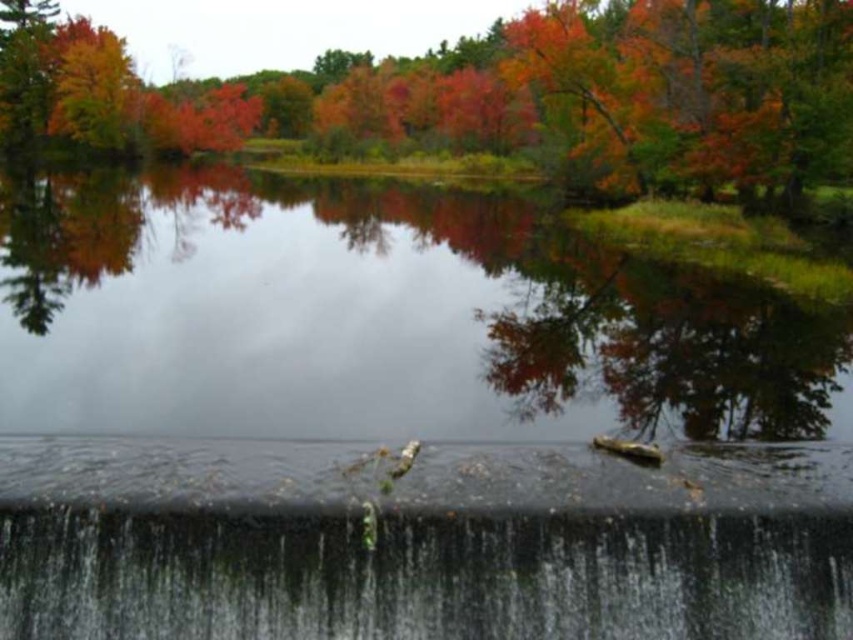
Question: Does autumn leaves at upper center have a greater width compared to green mossy concrete waterfall at lower center?

Choices:
 (A) no
 (B) yes

Answer: (B)

Question: Is autumn leaves at upper center thinner than green mossy concrete waterfall at lower center?

Choices:
 (A) no
 (B) yes

Answer: (A)

Question: Does autumn leaves at upper center appear over green mossy concrete waterfall at lower center?

Choices:
 (A) no
 (B) yes

Answer: (B)

Question: Which object appears closest to the camera in this image?

Choices:
 (A) green mossy concrete waterfall at lower center
 (B) autumn leaves at upper center

Answer: (A)

Question: Which object appears closest to the camera in this image?

Choices:
 (A) autumn leaves at upper center
 (B) green mossy concrete waterfall at lower center

Answer: (B)